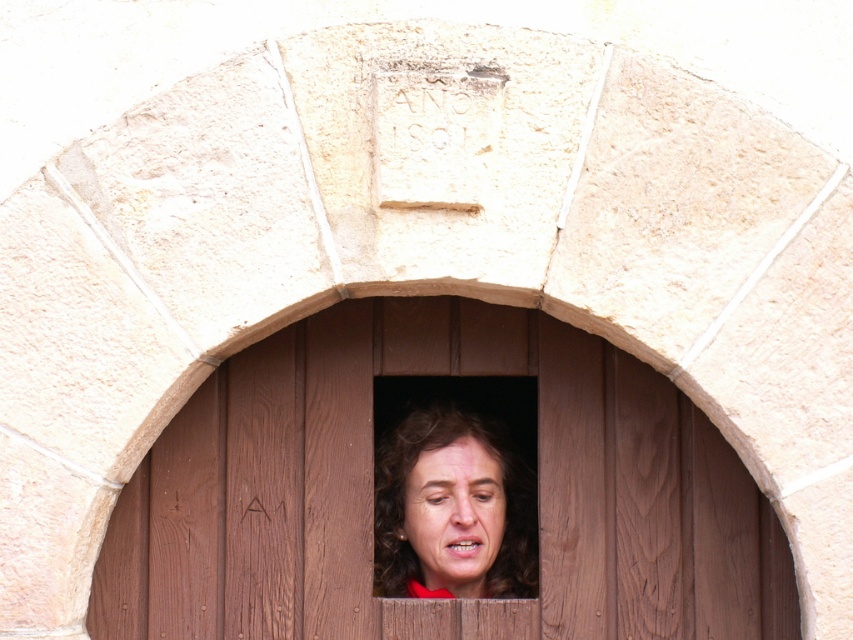
Question: Which point is farther to the camera?

Choices:
 (A) (465, 490)
 (B) (467, 413)
 (C) (666, 385)

Answer: (B)

Question: Can you confirm if brown wooden window at center is smaller than curly brown hair at center?

Choices:
 (A) yes
 (B) no

Answer: (B)

Question: Is curly brown hair at center positioned before smooth skin face at center?

Choices:
 (A) no
 (B) yes

Answer: (A)

Question: Which point is closer to the camera?

Choices:
 (A) curly brown hair at center
 (B) brown wooden window at center
 (C) smooth skin face at center

Answer: (B)

Question: Does curly brown hair at center appear on the right side of smooth skin face at center?

Choices:
 (A) yes
 (B) no

Answer: (A)

Question: Based on their relative distances, which object is farther from the brown wooden window at center?

Choices:
 (A) smooth skin face at center
 (B) curly brown hair at center

Answer: (A)